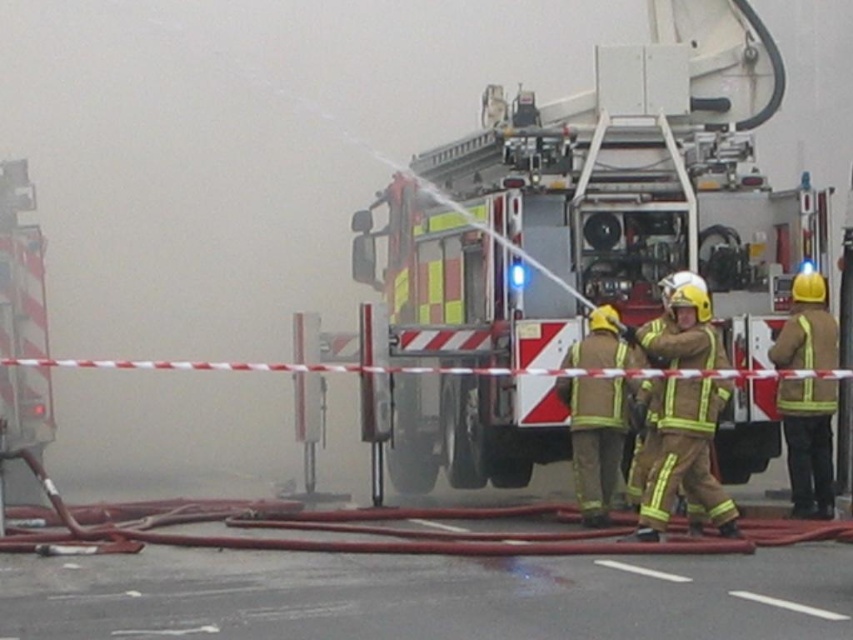
Question: Is yellow reflective uniform at right further to the viewer compared to reflective gold helmet at center?

Choices:
 (A) yes
 (B) no

Answer: (A)

Question: Which point is farther from the camera taking this photo?

Choices:
 (A) (680, 292)
 (B) (633, 385)
 (C) (822, 465)

Answer: (C)

Question: Can you confirm if reflective silver fire truck at center is smaller than yellow reflective uniform at center?

Choices:
 (A) no
 (B) yes

Answer: (B)

Question: Estimate the real-world distances between objects in this image. Which object is farther from the reflective silver fire truck at center?

Choices:
 (A) yellow reflective uniform at center
 (B) reflective gold helmet at center
 (C) yellow reflective uniform at right

Answer: (A)

Question: Is reflective silver fire truck at center above yellow reflective uniform at right?

Choices:
 (A) yes
 (B) no

Answer: (A)

Question: Which point is closer to the camera?

Choices:
 (A) [x=598, y=451]
 (B) [x=657, y=333]
 (C) [x=682, y=154]
 (D) [x=799, y=435]

Answer: (B)